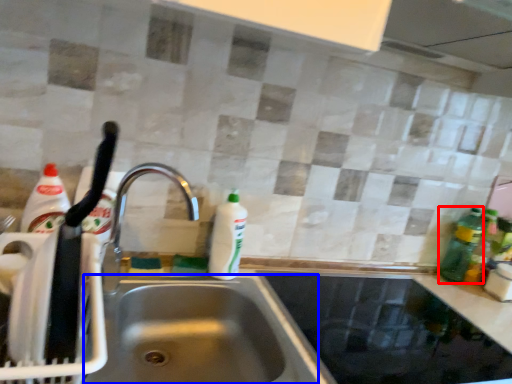
Question: Which point is closer to the camera, bottle (highlighted by a red box) or sink (highlighted by a blue box)?

Choices:
 (A) bottle
 (B) sink

Answer: (B)